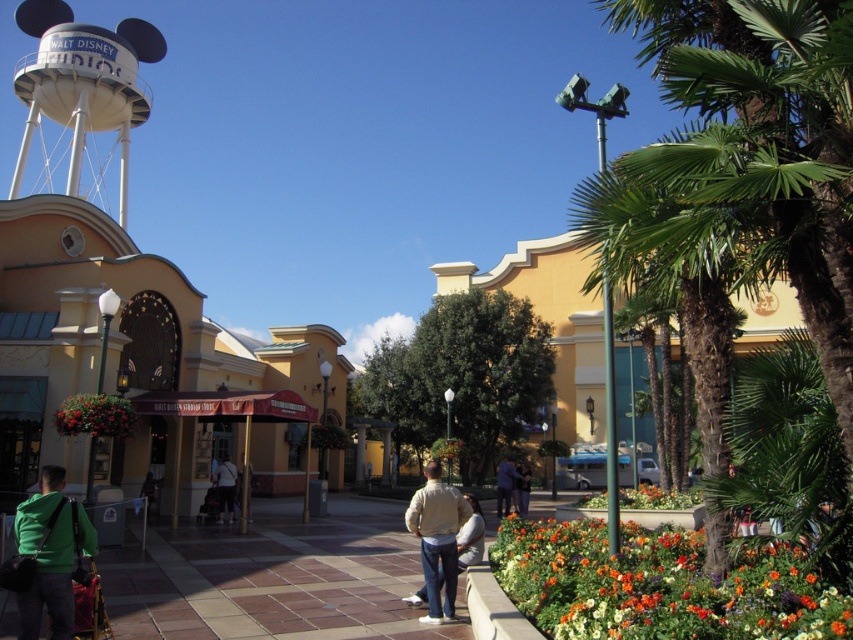
You are planning to take a photo of the vivid red flowers at center and the green leafy palm tree at center right. Which object should you focus on first if you want to capture both in a single frame without moving the camera?

You should focus on the green leafy palm tree at center right first because it is taller than the vivid red flowers at center, allowing both to fit within the frame when positioned properly.

You are standing at the Walt Disney Studios, looking at the scene described. There are two points marked in the image, one at coordinates point (x=848, y=20) and the other at point (x=39, y=605). Which point is nearer to your viewpoint?

Point (x=848, y=20) is closer to the camera than point (x=39, y=605), so the point at coordinates point (x=848, y=20) is nearer to your viewpoint.

You are standing at the center of the walkway and want to find the green leafy palm tree at center right. Which direction should you look to see the point at coordinates [746,164]?

The point at coordinates [746,164] is located on the green leafy palm tree at center right, so you should look to your right to see it.